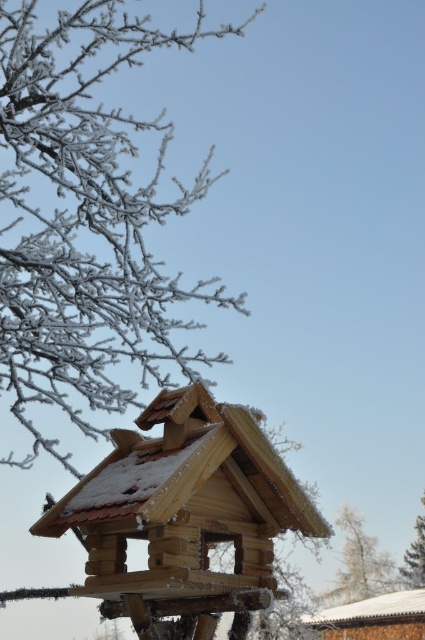
Based on the photo, is wooden hut at lower right positioned in front of white frosty tree at lower right?

No, it is not.

Looking at this image, between wooden hut at lower right and white frosty tree at lower right, which one has less height?

With less height is wooden hut at lower right.

This screenshot has width=425, height=640. I want to click on wooden hut at lower right, so click(x=374, y=618).

Does wooden hut at lower right have a greater height compared to frosty wood tree at upper left?

No.

Consider the image. Is wooden hut at lower right further to camera compared to frosty wood tree at upper left?

Yes, it is.

Does point (311, 616) come farther from viewer compared to point (362, 596)?

No, (311, 616) is closer to viewer.

This screenshot has height=640, width=425. What are the coordinates of `wooden hut at lower right` in the screenshot? It's located at (374, 618).

Is the position of frosted branches at upper left less distant than that of wooden hut at lower right?

Yes, it is.

Looking at this image, between frosted branches at upper left and wooden hut at lower right, which one has more height?

frosted branches at upper left is taller.

Does point (93, 176) come closer to viewer compared to point (363, 620)?

Yes, it is in front of point (363, 620).

Image resolution: width=425 pixels, height=640 pixels. What are the coordinates of `frosted branches at upper left` in the screenshot? It's located at (85, 220).